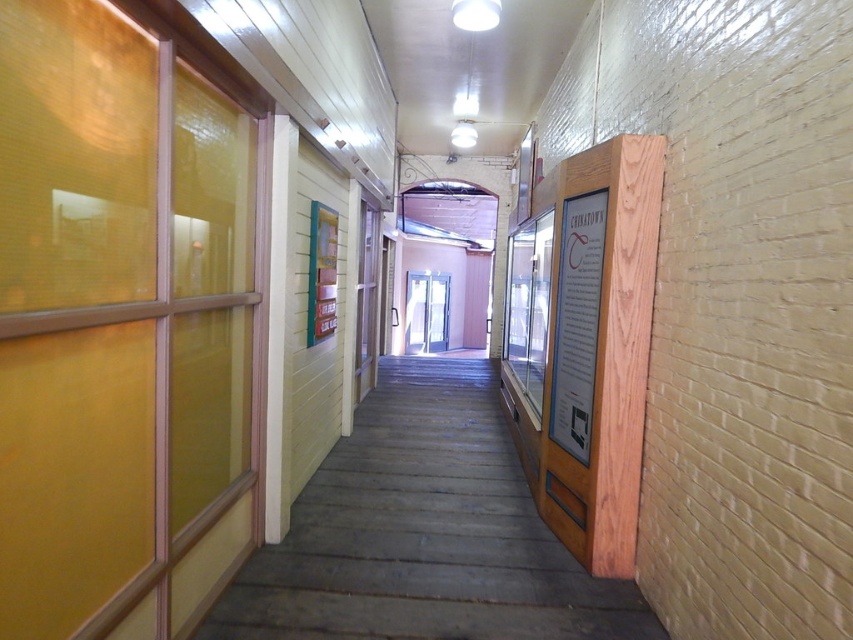
Question: Is wooden stairs at center behind wooden door at center?

Choices:
 (A) no
 (B) yes

Answer: (A)

Question: Does wooden door at center have a larger size compared to white glossy door at center?

Choices:
 (A) no
 (B) yes

Answer: (A)

Question: Which point appears farthest from the camera in this image?

Choices:
 (A) (369, 312)
 (B) (416, 628)

Answer: (A)

Question: Does wooden stairs at center come behind wooden door at center?

Choices:
 (A) yes
 (B) no

Answer: (B)

Question: Among these points, which one is farthest from the camera?

Choices:
 (A) (444, 344)
 (B) (387, 365)

Answer: (A)

Question: Which is farther from the white glossy door at center?

Choices:
 (A) wooden door at center
 (B) wooden stairs at center

Answer: (B)